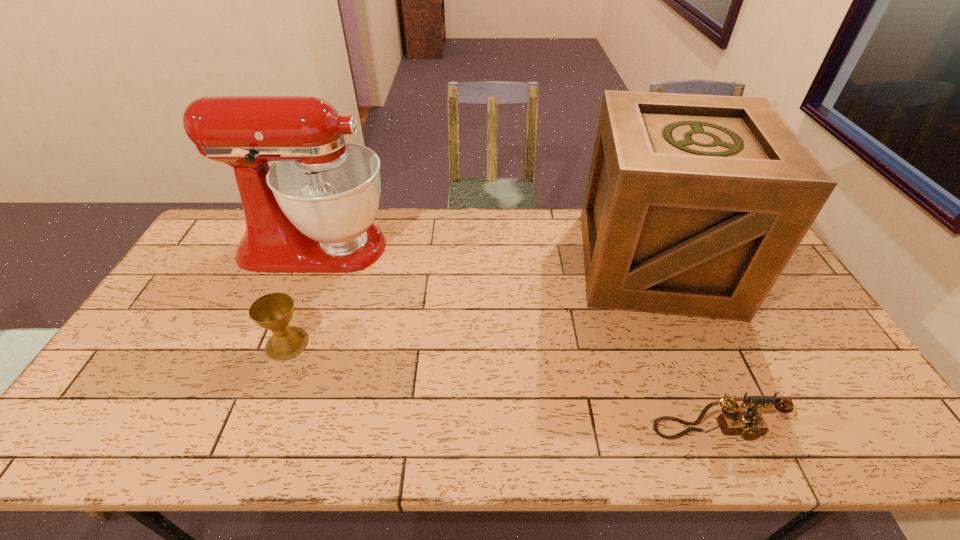
This screenshot has width=960, height=540. What are the coordinates of `mixer` in the screenshot? It's located at (311, 211).

You are a GUI agent. You are given a task and a screenshot of the screen. Output one action in this format:
    pyautogui.click(x=<x>, y=<y>)
    Task: Click on the box
    This screenshot has height=540, width=960.
    Given the screenshot: What is the action you would take?
    pyautogui.click(x=694, y=204)

The width and height of the screenshot is (960, 540). Find the location of `chalice`. chalice is located at coordinates (273, 311).

I want to click on the nearest object, so click(x=749, y=424).

Identify the location of vacant space positioned 0.290m at the attachment hub of the mixer. The width and height of the screenshot is (960, 540). (479, 247).

Locate an element on the screen. The height and width of the screenshot is (540, 960). free location located 0.090m on the left of the box is located at coordinates (549, 262).

Identify the location of free space located on the front of the chalice. (252, 433).

This screenshot has height=540, width=960. I want to click on mixer that is at the far edge, so click(x=311, y=211).

Identify the location of box situated at the far edge. This screenshot has height=540, width=960. (694, 204).

What are the coordinates of `object positioned at the near edge` in the screenshot? It's located at (749, 424).